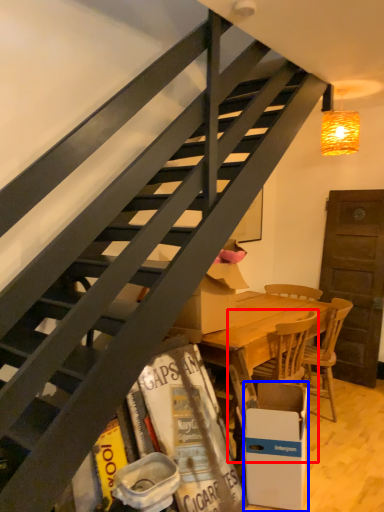
Question: Which of the following is the farthest to the observer, chair (highlighted by a red box) or box (highlighted by a blue box)?

Choices:
 (A) chair
 (B) box

Answer: (A)